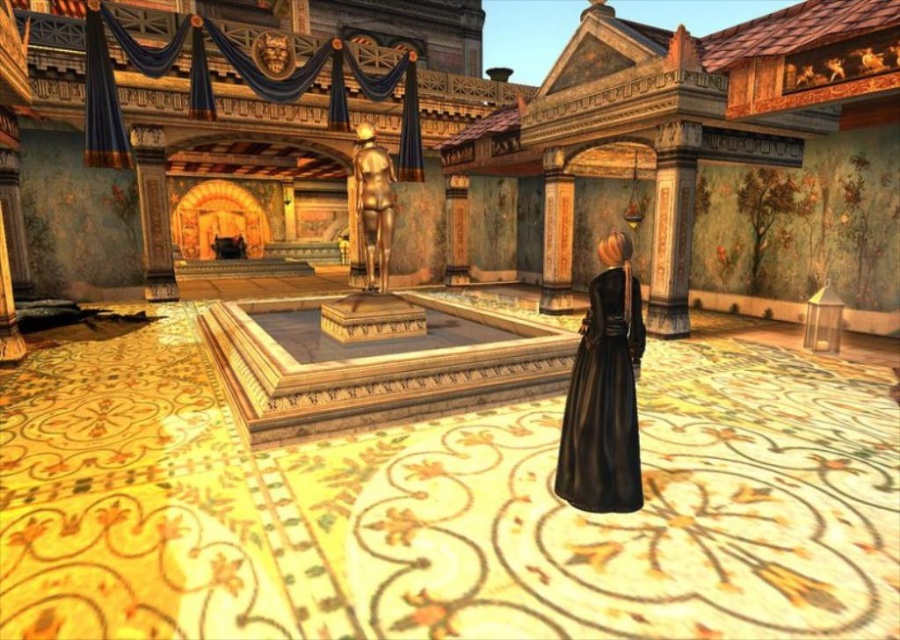
Question: Can you confirm if black leather dress at lower right is positioned below gold polished statue at center?

Choices:
 (A) yes
 (B) no

Answer: (A)

Question: Does black leather dress at lower right appear under gold polished statue at center?

Choices:
 (A) no
 (B) yes

Answer: (B)

Question: Which of the following is the farthest from the observer?

Choices:
 (A) black leather dress at lower right
 (B) gold polished statue at center

Answer: (B)

Question: Is black leather dress at lower right positioned behind gold polished statue at center?

Choices:
 (A) yes
 (B) no

Answer: (B)

Question: Which point is closer to the camera taking this photo?

Choices:
 (A) (356, 157)
 (B) (568, 412)

Answer: (B)